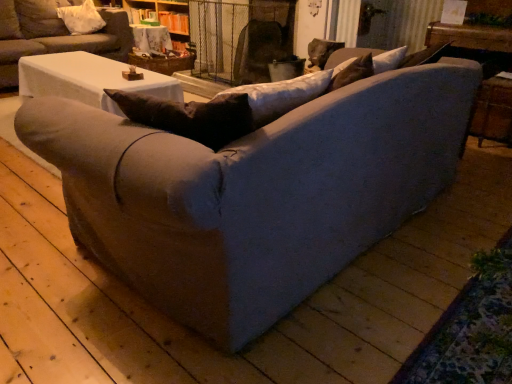
Find the location of a particular element. This screenshot has width=512, height=384. matte gray couch at center, arranged as the second studio couch when ordered from the bottom is located at coordinates (54, 35).

Image resolution: width=512 pixels, height=384 pixels. Identify the location of white fabric pillow at upper left. (81, 18).

What is the approximate width of white fabric pillow at upper left?

The width of white fabric pillow at upper left is 16.41 inches.

At what (x,y) coordinates should I click in order to perform the action: click on textured gray couch at center, the 2th studio couch viewed from the top. Please return your answer as a coordinate pair (x, y). The height and width of the screenshot is (384, 512). Looking at the image, I should click on (254, 193).

Image resolution: width=512 pixels, height=384 pixels. In order to click on pillow behind the matte gray couch at center, the 1th studio couch from the top in this screenshot , I will do pyautogui.click(x=81, y=18).

Is white fabric pillow at upper left aimed at matte gray couch at center, the 1th studio couch from the top?

Yes, white fabric pillow at upper left is facing matte gray couch at center, the 1th studio couch from the top.

Which is less distant, (80,23) or (60,29)?

Point (80,23) appears to be farther away from the viewer than point (60,29).

From a real-world perspective, is wooden textured table at upper center below matte gray couch at center, the 1th studio couch from the top?

Yes, from a real-world perspective, wooden textured table at upper center is beneath matte gray couch at center, the 1th studio couch from the top.

Measure the distance between wooden textured table at upper center and matte gray couch at center, the 1th studio couch from the top.

wooden textured table at upper center is 24.66 inches away from matte gray couch at center, the 1th studio couch from the top.

Is wooden textured table at upper center touching matte gray couch at center, the 1th studio couch from the top?

No, wooden textured table at upper center is not making contact with matte gray couch at center, the 1th studio couch from the top.

From the image's perspective, is wooden textured table at upper center below matte gray couch at center, arranged as the second studio couch when ordered from the bottom?

No, from the image's perspective, wooden textured table at upper center is not below matte gray couch at center, arranged as the second studio couch when ordered from the bottom.

Which point is more forward, [203,295] or [163,50]?

The point [203,295] is more forward.

Is textured gray couch at center, the 2th studio couch viewed from the top, in front of wooden textured table at upper center?

Yes, the depth of textured gray couch at center, the 2th studio couch viewed from the top, is less than that of wooden textured table at upper center.

In the scene shown: Do you think textured gray couch at center, which is the first studio couch in bottom-to-top order, is within wooden textured table at upper center, or outside of it?

The correct answer is: outside.

From a real-world perspective, which object rests below the other?

textured gray couch at center, which is the first studio couch in bottom-to-top order, from a real-world perspective.

Is matte gray couch at center, arranged as the second studio couch when ordered from the bottom, positioned behind textured gray couch at center, which is the first studio couch in bottom-to-top order?

Yes, it is.

Can you confirm if matte gray couch at center, arranged as the second studio couch when ordered from the bottom, is thinner than textured gray couch at center, the 2th studio couch viewed from the top?

Indeed, matte gray couch at center, arranged as the second studio couch when ordered from the bottom, has a lesser width compared to textured gray couch at center, the 2th studio couch viewed from the top.

Are matte gray couch at center, arranged as the second studio couch when ordered from the bottom, and textured gray couch at center, the 2th studio couch viewed from the top, making contact?

No, matte gray couch at center, arranged as the second studio couch when ordered from the bottom, is not making contact with textured gray couch at center, the 2th studio couch viewed from the top.

Is matte gray couch at center, the 1th studio couch from the top, taller or shorter than textured gray couch at center, the 2th studio couch viewed from the top?

matte gray couch at center, the 1th studio couch from the top, is taller than textured gray couch at center, the 2th studio couch viewed from the top.

Between white fabric pillow at upper left and textured gray couch at center, the 2th studio couch viewed from the top, which one has smaller size?

white fabric pillow at upper left.

Locate an element on the screen. This screenshot has width=512, height=384. pillow behind the textured gray couch at center, the 2th studio couch viewed from the top is located at coordinates click(81, 18).

Is white fabric pillow at upper left looking in the opposite direction of textured gray couch at center, which is the first studio couch in bottom-to-top order?

white fabric pillow at upper left does not have its back to textured gray couch at center, which is the first studio couch in bottom-to-top order.

From a real-world perspective, which studio couch is the 1st one underneath the white fabric pillow at upper left? Please provide its 2D coordinates.

[(54, 35)]

Considering the relative sizes of matte gray couch at center, the 1th studio couch from the top, and white fabric pillow at upper left in the image provided, is matte gray couch at center, the 1th studio couch from the top, shorter than white fabric pillow at upper left?

In fact, matte gray couch at center, the 1th studio couch from the top, may be taller than white fabric pillow at upper left.

How much distance is there between matte gray couch at center, arranged as the second studio couch when ordered from the bottom, and white fabric pillow at upper left?

matte gray couch at center, arranged as the second studio couch when ordered from the bottom, and white fabric pillow at upper left are 10.77 inches apart from each other.

From a real-world perspective, who is located higher, wooden textured table at upper center or white fabric pillow at upper left?

white fabric pillow at upper left is physically above.

Can you see wooden textured table at upper center touching white fabric pillow at upper left?

They are not placed beside each other.

Between wooden textured table at upper center and white fabric pillow at upper left, which one is positioned behind?

Positioned behind is wooden textured table at upper center.

Considering the positions of objects wooden textured table at upper center and white fabric pillow at upper left in the image provided, who is more to the right, wooden textured table at upper center or white fabric pillow at upper left?

From the viewer's perspective, wooden textured table at upper center appears more on the right side.

From a real-world perspective, starting from the white fabric pillow at upper left, which studio couch is the 1st one below it? Please provide its 2D coordinates.

[(54, 35)]

Identify the location of studio couch that is the 1st one when counting forward from the wooden textured table at upper center. (54, 35).

Looking at this image, from the image, which object appears to be farther from textured gray couch at center, which is the first studio couch in bottom-to-top order, white fabric pillow at upper left or wooden textured table at upper center?

white fabric pillow at upper left is positioned further to the anchor textured gray couch at center, which is the first studio couch in bottom-to-top order.

Based on their spatial positions, is matte gray couch at center, the 1th studio couch from the top, or white fabric pillow at upper left further from textured gray couch at center, the 2th studio couch viewed from the top?

Among the two, white fabric pillow at upper left is located further to textured gray couch at center, the 2th studio couch viewed from the top.

Which object lies further to the anchor point wooden textured table at upper center, matte gray couch at center, arranged as the second studio couch when ordered from the bottom, or white fabric pillow at upper left?

matte gray couch at center, arranged as the second studio couch when ordered from the bottom, lies further to wooden textured table at upper center than the other object.

Considering their positions, is matte gray couch at center, the 1th studio couch from the top, positioned closer to white fabric pillow at upper left than wooden textured table at upper center?

matte gray couch at center, the 1th studio couch from the top, lies closer to white fabric pillow at upper left than the other object.

Which object lies nearer to the anchor point matte gray couch at center, the 1th studio couch from the top, wooden textured table at upper center or textured gray couch at center, the 2th studio couch viewed from the top?

Based on the image, wooden textured table at upper center appears to be nearer to matte gray couch at center, the 1th studio couch from the top.

When comparing their distances from matte gray couch at center, arranged as the second studio couch when ordered from the bottom, does white fabric pillow at upper left or textured gray couch at center, the 2th studio couch viewed from the top, seem further?

The object further to matte gray couch at center, arranged as the second studio couch when ordered from the bottom, is textured gray couch at center, the 2th studio couch viewed from the top.

Which object lies nearer to the anchor point textured gray couch at center, which is the first studio couch in bottom-to-top order, white fabric pillow at upper left or matte gray couch at center, the 1th studio couch from the top?

matte gray couch at center, the 1th studio couch from the top, lies closer to textured gray couch at center, which is the first studio couch in bottom-to-top order, than the other object.

From the image, which object appears to be nearer to matte gray couch at center, the 1th studio couch from the top, wooden textured table at upper center or white fabric pillow at upper left?

Based on the image, white fabric pillow at upper left appears to be nearer to matte gray couch at center, the 1th studio couch from the top.

In order to click on pillow between matte gray couch at center, the 1th studio couch from the top, and wooden textured table at upper center in the front-back direction in this screenshot , I will do `click(81, 18)`.

What are the coordinates of `studio couch between textured gray couch at center, which is the first studio couch in bottom-to-top order, and wooden textured table at upper center in the front-back direction` in the screenshot? It's located at (54, 35).

Where is `studio couch located between textured gray couch at center, which is the first studio couch in bottom-to-top order, and white fabric pillow at upper left in the depth direction`? studio couch located between textured gray couch at center, which is the first studio couch in bottom-to-top order, and white fabric pillow at upper left in the depth direction is located at coordinates (54, 35).

This screenshot has height=384, width=512. I want to click on pillow between textured gray couch at center, the 2th studio couch viewed from the top, and wooden textured table at upper center from front to back, so click(x=81, y=18).